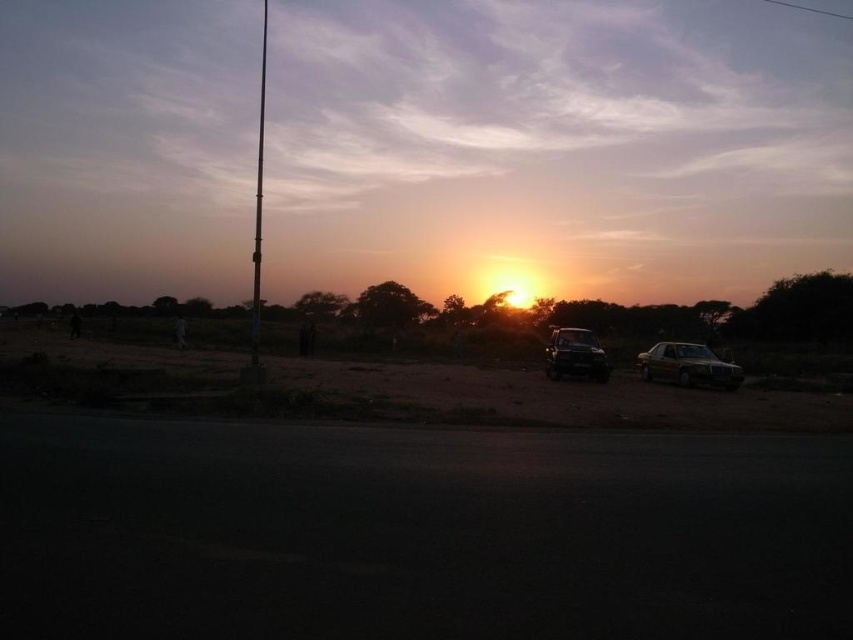
Question: Among these points, which one is farthest from the camera?

Choices:
 (A) tap(316, 403)
 (B) tap(578, 348)
 (C) tap(703, 349)
 (D) tap(264, 68)

Answer: (D)

Question: Can you confirm if brown sandy dirt field at center is positioned below metallic pole at left?

Choices:
 (A) no
 (B) yes

Answer: (B)

Question: Is shiny metallic car at center positioned in front of metallic pole at left?

Choices:
 (A) yes
 (B) no

Answer: (B)

Question: Which object appears closest to the camera in this image?

Choices:
 (A) shiny metallic car at center
 (B) metallic gold sedan at right
 (C) metallic pole at left

Answer: (C)

Question: Which point is farther from the camera taking this photo?

Choices:
 (A) (564, 333)
 (B) (556, 388)
 (C) (709, 352)
 (D) (256, 305)

Answer: (A)

Question: Is metallic gold sedan at right bigger than shiny metallic car at center?

Choices:
 (A) yes
 (B) no

Answer: (A)